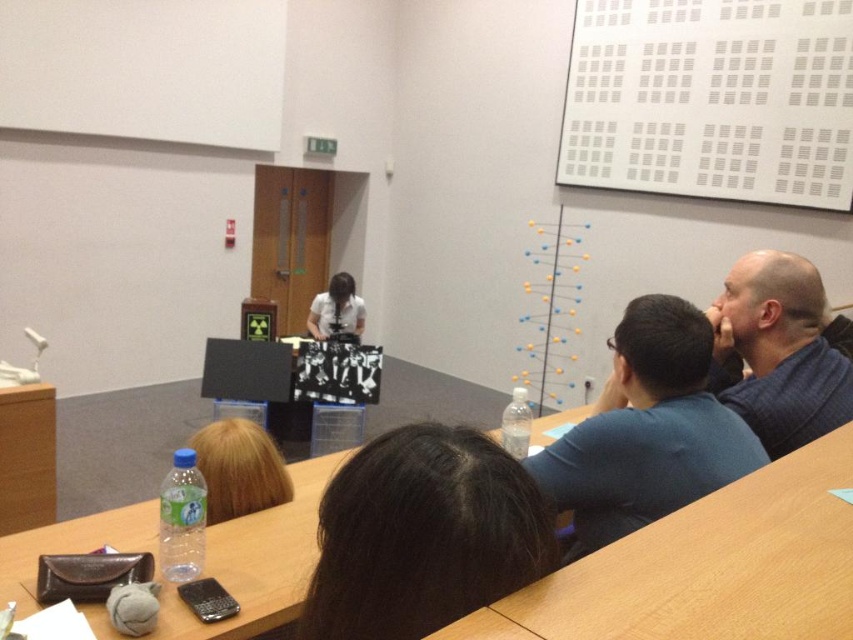
You are an attendee at the presentation. You need to look at the white matte board at upper center to take notes but want to avoid blocking the presenter with your notebook. Since the dark brown hair at center belongs to the presenter, where should you position your notebook relative to the presenter?

You should position your notebook below the presenter because the white matte board at upper center is above the dark brown hair at center, so placing the notebook below would keep it out of the presenter dark brown hair at center line of sight.

You are an attendee at the conference. You want to place your notebook on the wooden table at lower center without blocking the dark brown hair at center. Is this possible?

The wooden table at lower center is positioned over dark brown hair at center, so placing the notebook there would block the dark brown hair at center. Choose another location on the table.